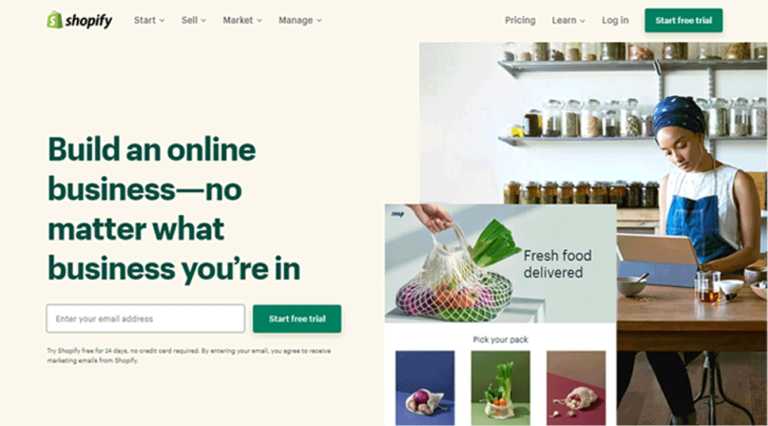
Locate an element on the screen. This screenshot has height=426, width=768. table is located at coordinates (654, 317), (521, 319), (485, 422), (583, 417), (398, 414).